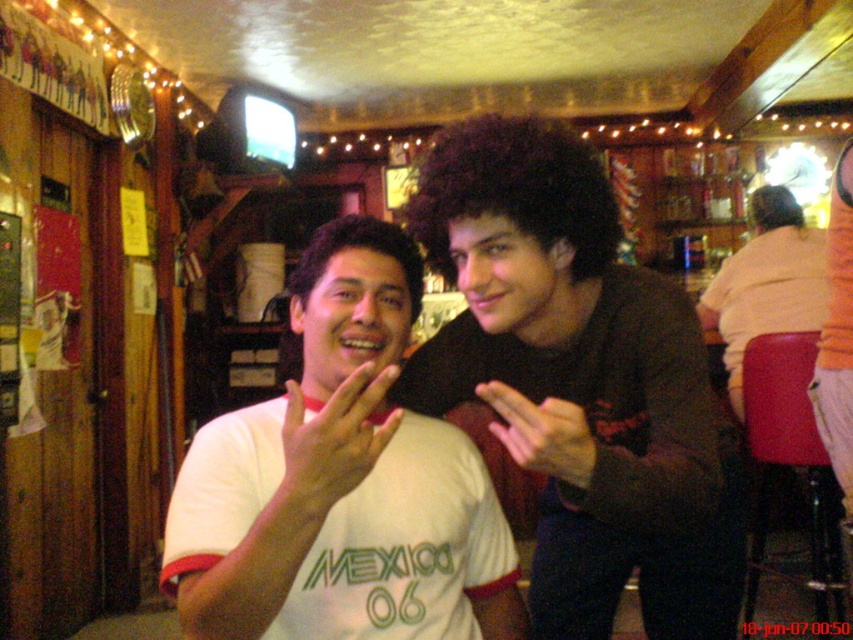
Can you confirm if white cotton t-shirt at center is smaller than light orange shirt at right?

Indeed, white cotton t-shirt at center has a smaller size compared to light orange shirt at right.

Does point (410, 621) come closer to viewer compared to point (788, 209)?

Yes.

Find the location of `white cotton t-shirt at center`. white cotton t-shirt at center is located at coordinates (341, 483).

How far apart are light orange shirt at right and pink matte hand at center?

light orange shirt at right is 2.06 meters from pink matte hand at center.

Which of these two, light orange shirt at right or pink matte hand at center, stands taller?

With more height is light orange shirt at right.

Describe the element at coordinates (766, 282) in the screenshot. The width and height of the screenshot is (853, 640). I see `light orange shirt at right` at that location.

Locate an element on the screen. The height and width of the screenshot is (640, 853). light orange shirt at right is located at coordinates (766, 282).

How much distance is there between dark brown hair at center and light orange shirt at right?

They are 1.75 meters apart.

This screenshot has height=640, width=853. In order to click on dark brown hair at center in this screenshot , I will do click(x=579, y=381).